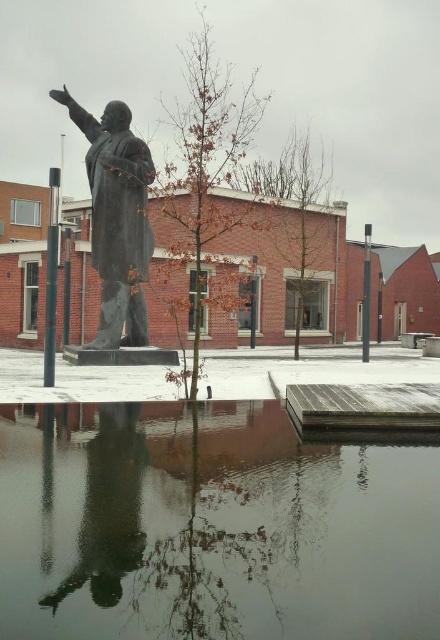
Looking at this image, measure the distance from smooth reflective water at center to black metal pole at right.

The distance of smooth reflective water at center from black metal pole at right is 47.12 feet.

Which is more to the left, smooth reflective water at center or black metal pole at right?

smooth reflective water at center

Measure the distance between smooth reflective water at center and camera.

smooth reflective water at center is 2.44 meters from camera.

Identify the location of smooth reflective water at center. (209, 525).

Based on the photo, who is positioned more to the right, smooth reflective water at center or bronze statue at center?

smooth reflective water at center is more to the right.

Who is higher up, smooth reflective water at center or bronze statue at center?

Positioned higher is bronze statue at center.

Measure the distance between point (x=147, y=596) and camera.

Point (x=147, y=596) and camera are 9.24 feet apart from each other.

You are a GUI agent. You are given a task and a screenshot of the screen. Output one action in this format:
    pyautogui.click(x=<x>, y=<y>)
    Task: Click on the smooth reflective water at center
    The height and width of the screenshot is (640, 440).
    Given the screenshot: What is the action you would take?
    click(209, 525)

Find the location of a particular element. The image size is (440, 640). bronze statue at center is located at coordinates (117, 218).

Between bronze statue at center and black metal pole at right, which one is positioned higher?

black metal pole at right

Does point (110, 179) come farther from viewer compared to point (366, 337)?

No.

The height and width of the screenshot is (640, 440). I want to click on bronze statue at center, so click(117, 218).